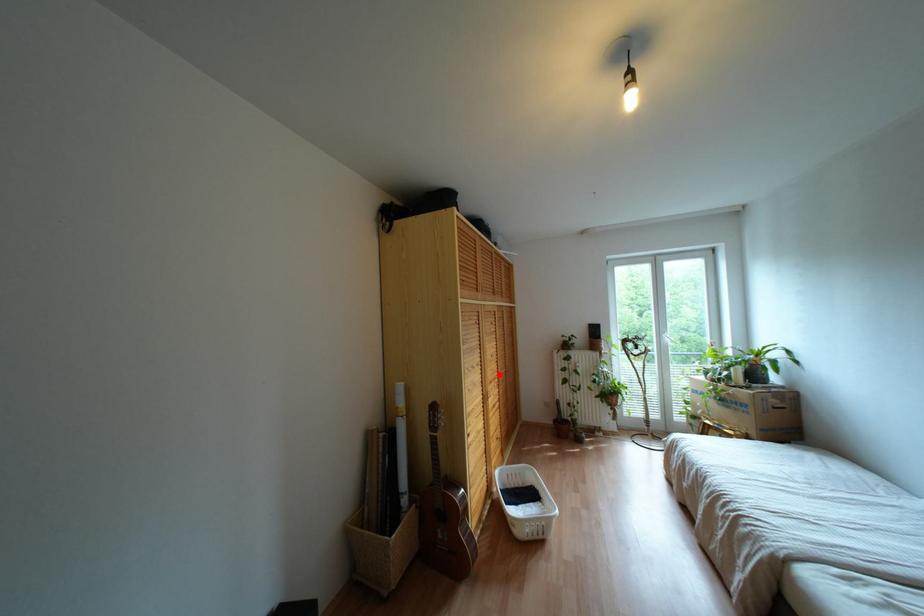
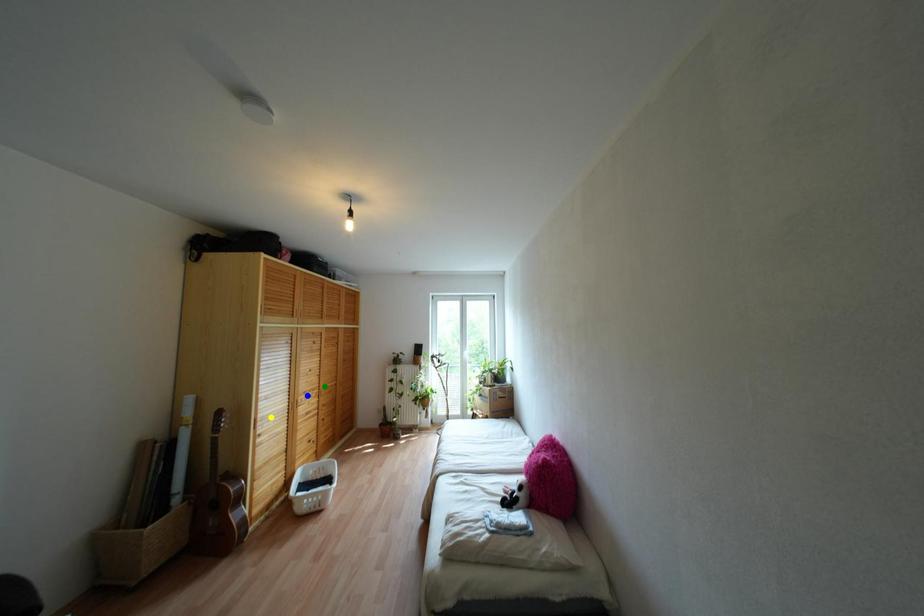
Question: I am providing you with two images of the same scene from different viewpoints. A red point is marked on the first image. You are given multiple points on the second image. In image 2, which mark is for the same physical point as the one in image 1?

Choices:
 (A) green point
 (B) blue point
 (C) yellow point

Answer: (A)